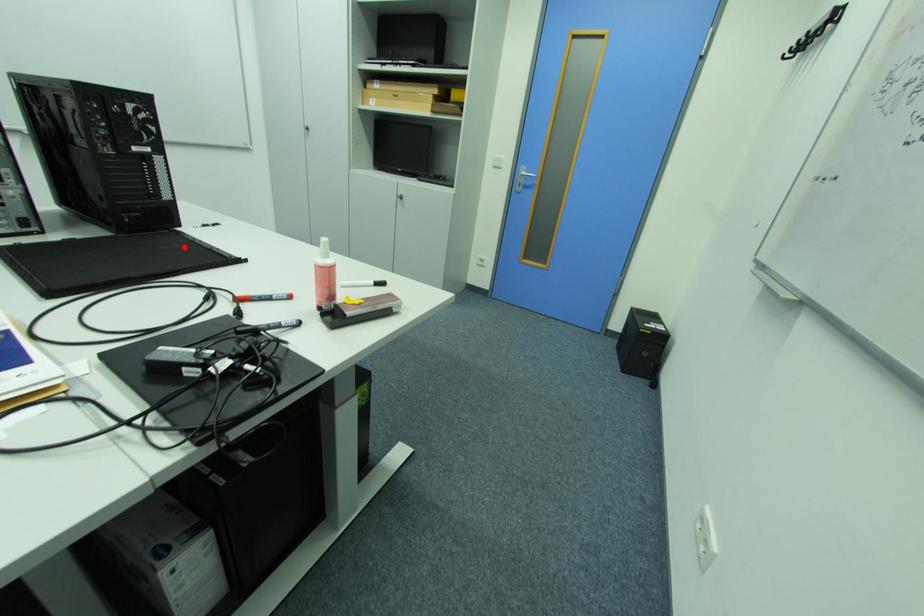
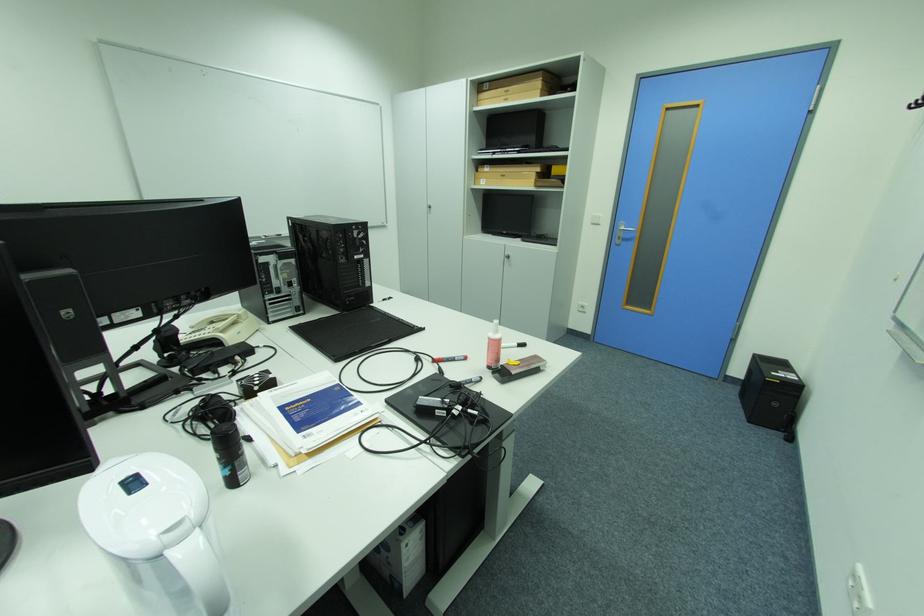
Question: I am providing you with two images of the same scene from different viewpoints. A red point is marked on the first image. At the location where the point appears in image 1, is it still visible in image 2?

Choices:
 (A) Yes
 (B) No

Answer: (A)